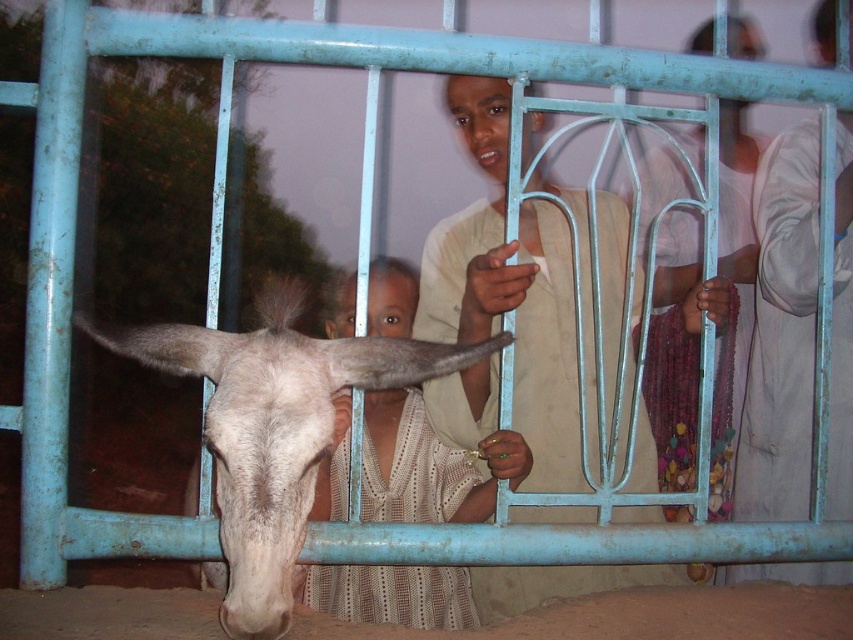
You are a photographer trying to capture a closeup of the light brown hair at center and the smooth skin head at upper center. Which object should you zoom in on to ensure it takes up more space in your photo?

The smooth skin head at upper center should be zoomed in on since it is larger in size compared to the light brown hair at center.

You are a photographer trying to capture a closeup of the light brown hair at center and the smooth skin head at upper center. Which object is lower in the frame?

The light brown hair at center is lower in the frame because it has a lesser height compared to the smooth skin head at upper center.